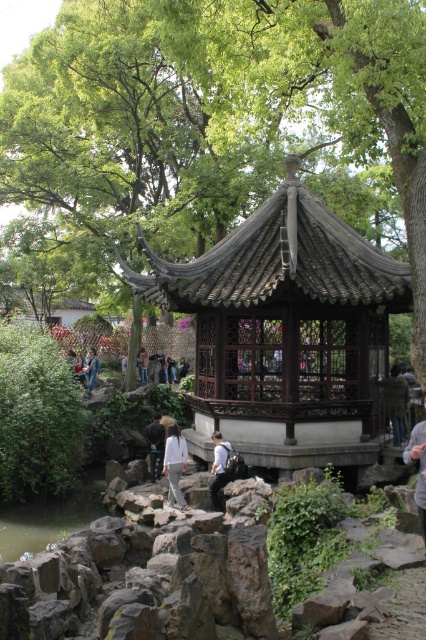
You are standing in the garden and want to pour water from the green liquid water at lower left onto the white cotton shirt at center. Is the water source positioned in a way that allows you to do this without needing to move the shirt?

The green liquid water at lower left is below the white cotton shirt at center, so you can pour the water upwards from the lower left to the shirt at center without needing to move the shirt.

You are standing in the traditional Chinese garden and want to take a photo of the green leafy tree at upper center. If your camera has a maximum focus range of 10 meters, will you be able to capture the tree clearly?

The green leafy tree at upper center is 10.75 meters from camera, which exceeds the camera maximum focus range of 10 meters. Therefore, the camera cannot focus on the tree clearly.

You are standing at the center of the pavilion in the traditional Chinese garden. You want to reach the point marked at coordinate (49, 516). Which direction should you walk to reach the point?

The point at coordinate (49, 516) is located on the green liquid water at lower left. Therefore, you should walk towards the lower left direction from the pavilion to reach it.